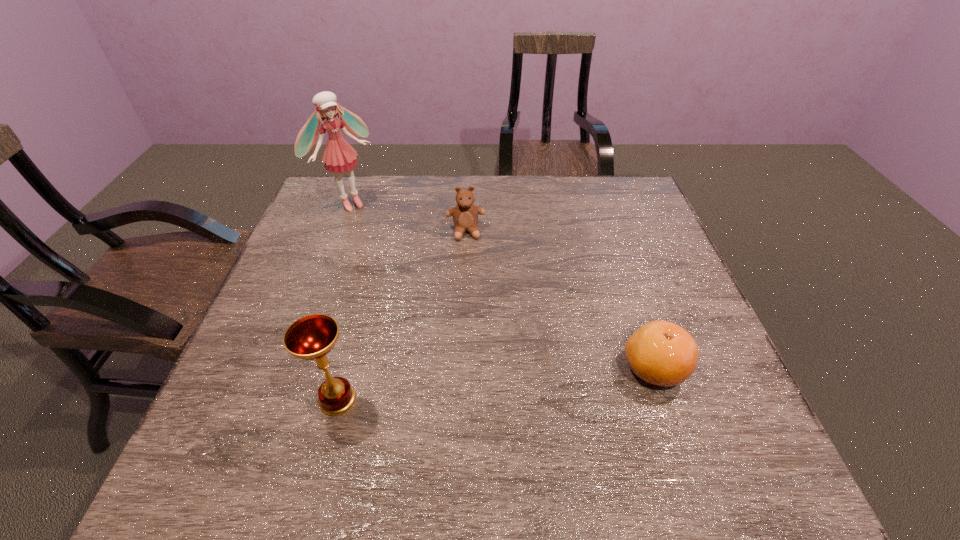
You are a GUI agent. You are given a task and a screenshot of the screen. Output one action in this format:
    pyautogui.click(x=<x>, y=<y>)
    Task: Click on the vacant space located on the front-facing side of the teddy bear
    The height and width of the screenshot is (540, 960).
    Given the screenshot: What is the action you would take?
    pyautogui.click(x=471, y=274)

Identify the location of vacant point located on the front-facing side of the teddy bear. The width and height of the screenshot is (960, 540). (470, 269).

Identify the location of vacant space situated on the front-facing side of the tallest object. The height and width of the screenshot is (540, 960). (402, 255).

Identify the location of free region located on the front-facing side of the tallest object. (421, 276).

The width and height of the screenshot is (960, 540). I want to click on free location located 0.050m on the front-facing side of the tallest object, so (370, 221).

You are a GUI agent. You are given a task and a screenshot of the screen. Output one action in this format:
    pyautogui.click(x=<x>, y=<y>)
    Task: Click on the object present at the far edge
    
    Given the screenshot: What is the action you would take?
    pyautogui.click(x=339, y=156)

The image size is (960, 540). Identify the location of chalice located at the near edge. [x=312, y=337].

The width and height of the screenshot is (960, 540). Find the location of `clementine located at the near edge`. clementine located at the near edge is located at coordinates (661, 353).

Locate an element on the screen. Image resolution: width=960 pixels, height=540 pixels. object that is at the left edge is located at coordinates [339, 156].

Image resolution: width=960 pixels, height=540 pixels. What are the coordinates of `object that is at the right edge` in the screenshot? It's located at (661, 353).